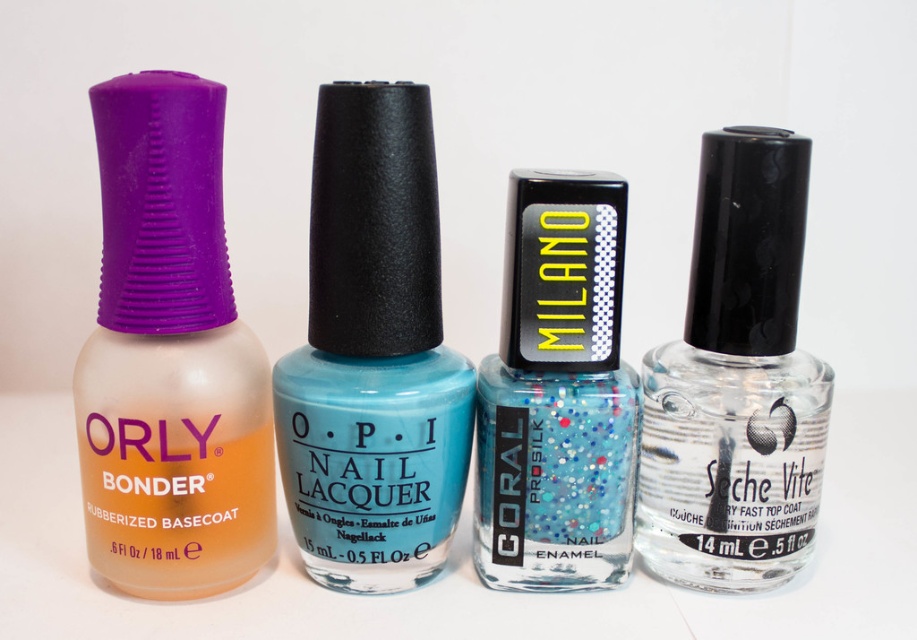
You need to place both the matte orange nail polish at left and the glittery blue nail enamel at center into a narrow storage compartment. Given their sizes, which one might not fit if the compartment can only accommodate the smaller width?

The matte orange nail polish at left has a larger width than the glittery blue nail enamel at center, so it might not fit into the narrow storage compartment.

From the picture: You are looking at the image of the four nail polish bottles. There are two points marked in the image. One is at coordinates point (159, 131) and the other is at point (577, 486). Which of these points is closer to you?

Point (159, 131) is closer to the viewer than point (577, 486).

You are organizing a beauty counter and need to place the teal glossy nail lacquer at center and the clear glass nail polish at right. Which one should you place first if you want to arrange them from left to right?

The teal glossy nail lacquer at center should be placed first on the left side before the clear glass nail polish at right since it is positioned on the left side of clear glass nail polish at right.